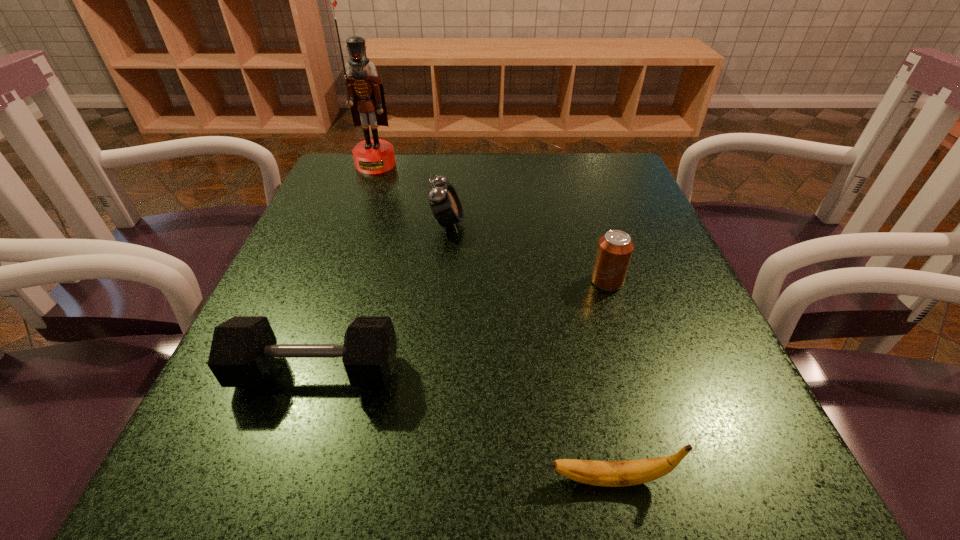
Find the location of a particular element. The height and width of the screenshot is (540, 960). object identified as the fourth closest to the alarm clock is located at coordinates (633, 472).

At what (x,y) coordinates should I click in order to perform the action: click on vacant area that satisfies the following two spatial constraints: 1. on the face of the fourth nearest object; 2. on the right side of the can. Please return your answer as a coordinate pair (x, y). This screenshot has width=960, height=540. Looking at the image, I should click on (443, 281).

Locate an element on the screen. blank area in the image that satisfies the following two spatial constraints: 1. on the back side of the can; 2. on the left side of the dumbbell is located at coordinates (347, 281).

Find the location of `free point that satisfies the following two spatial constraints: 1. on the front-facing side of the can; 2. on the right side of the farthest object`. free point that satisfies the following two spatial constraints: 1. on the front-facing side of the can; 2. on the right side of the farthest object is located at coordinates (333, 281).